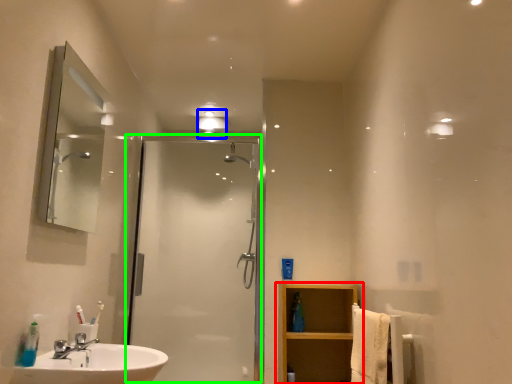
Question: Based on their relative distances, which object is farther from bathroom cabinet (highlighted by a red box)? Choose from light fixture (highlighted by a blue box) and screen door (highlighted by a green box).

Choices:
 (A) light fixture
 (B) screen door

Answer: (A)